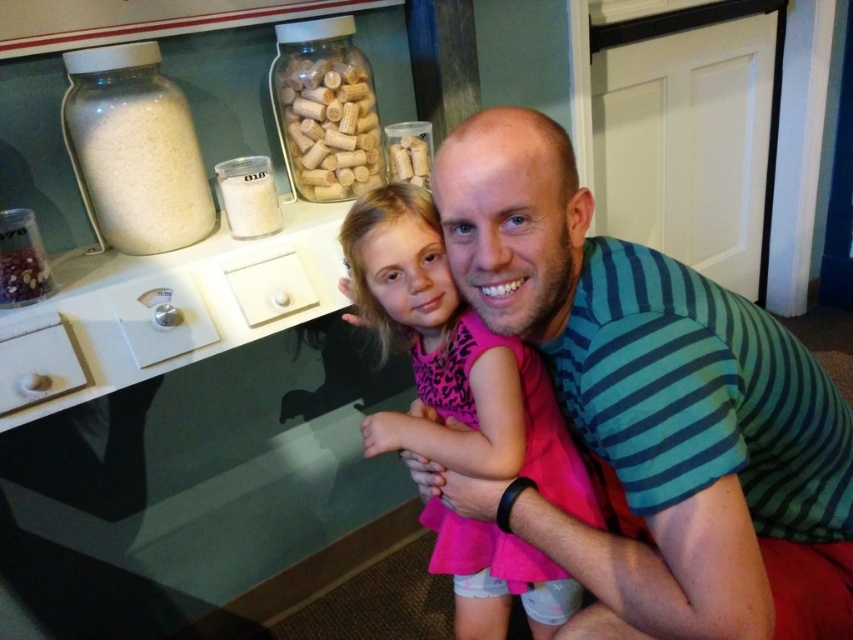
Question: Among these objects, which one is farthest from the camera?

Choices:
 (A) wooden corks at upper center
 (B) pink fabric dress at center
 (C) shiny metallic beads at left
 (D) green striped shirt at center

Answer: (A)

Question: Observing the image, what is the correct spatial positioning of green striped shirt at center in reference to shiny metallic beads at left?

Choices:
 (A) left
 (B) right

Answer: (B)

Question: Is green striped shirt at center bigger than wooden corks at upper center?

Choices:
 (A) no
 (B) yes

Answer: (B)

Question: Based on their relative distances, which object is nearer to the pink fabric dress at center?

Choices:
 (A) wooden corks at upper center
 (B) shiny metallic beads at left
 (C) green striped shirt at center

Answer: (C)

Question: Does pink fabric dress at center appear on the right side of wooden corks at upper center?

Choices:
 (A) yes
 (B) no

Answer: (A)

Question: Which of the following is the farthest from the observer?

Choices:
 (A) shiny metallic beads at left
 (B) wooden corks at upper center
 (C) pink fabric dress at center

Answer: (B)